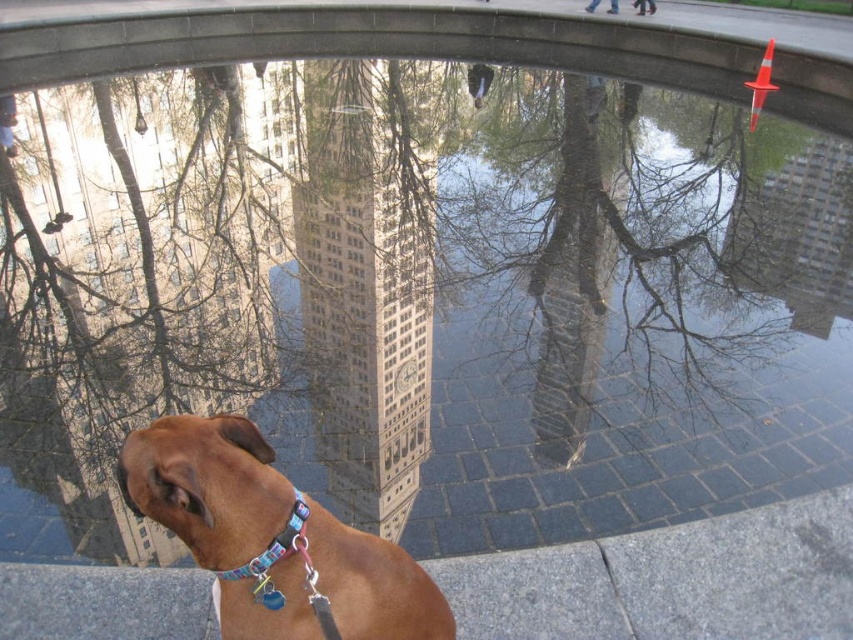
You are standing at the point where the dog is located in the image. You want to know how far you are from the point marked at coordinates point (567, 76). Can you determine the distance?

The distance of point (567, 76) from camera is 41.24 feet, so you are 41.24 feet away from the point marked at coordinates point (567, 76).